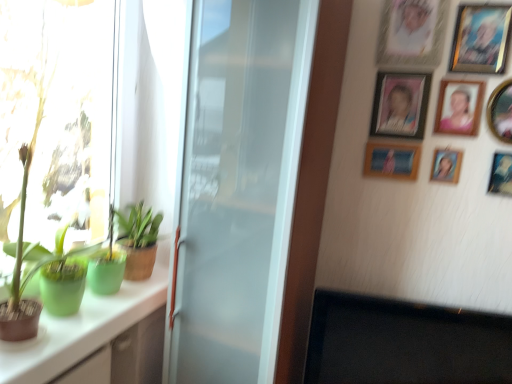
Question: Would you say white glossy cabinet at left is inside or outside satin white refrigerator at center?

Choices:
 (A) inside
 (B) outside

Answer: (B)

Question: Based on their positions, is white glossy cabinet at left located to the left or right of satin white refrigerator at center?

Choices:
 (A) left
 (B) right

Answer: (A)

Question: Based on their relative distances, which object is nearer to the metallic gold picture frame at upper right, the fifth picture frame positioned from the top?

Choices:
 (A) green matte plant at left, positioned as the second houseplant in bottom-to-top order
 (B) wooden picture frame at upper right, which is the seventh picture frame from bottom to top
 (C) metallic silver picture frame at upper right, arranged as the first picture frame when ordered from the bottom
 (D) matte plastic picture frame at upper right, the 4th picture frame viewed from the top
 (E) wooden picture frame at upper right, which is counted as the 3th picture frame, starting from the bottom

Answer: (D)

Question: Which object is positioned farthest from the wooden picture frame at upper right, the sixth picture frame in the top-to-bottom sequence?

Choices:
 (A) metallic gold picture frame at upper right, the fifth picture frame positioned from the top
 (B) white glossy cabinet at left
 (C) matte plastic picture frame at upper right, the 5th picture frame in the bottom-to-top sequence
 (D) satin white refrigerator at center
 (E) green matte plant at left, positioned as the second houseplant in bottom-to-top order

Answer: (B)